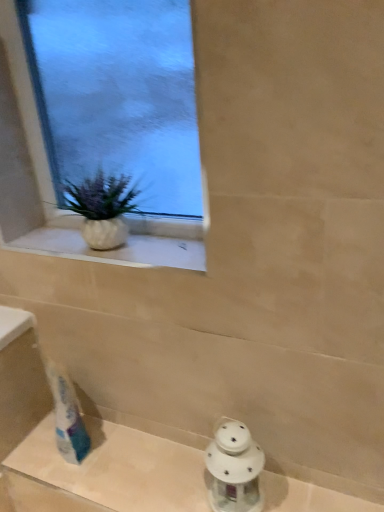
Identify the location of vacant space situated on the left part of white porcelain lantern at lower right. [168, 479].